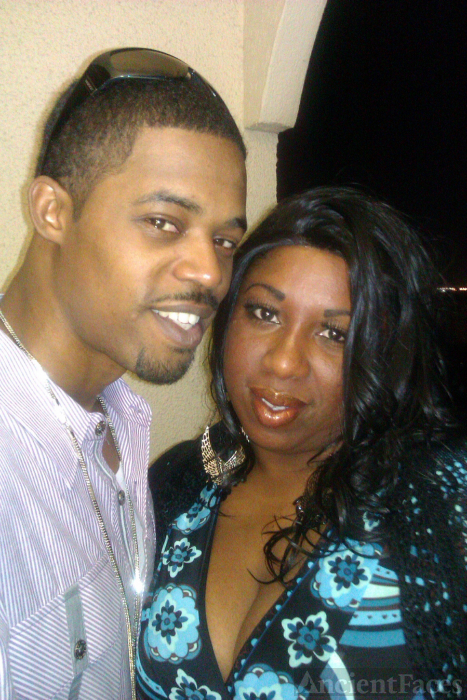
This screenshot has width=467, height=700. Identify the location of wall. (18, 78).